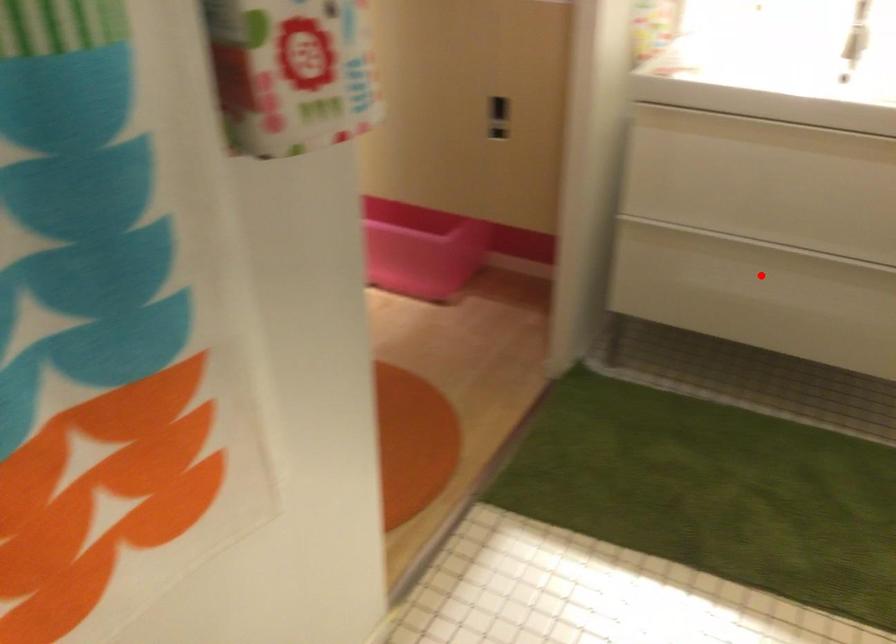
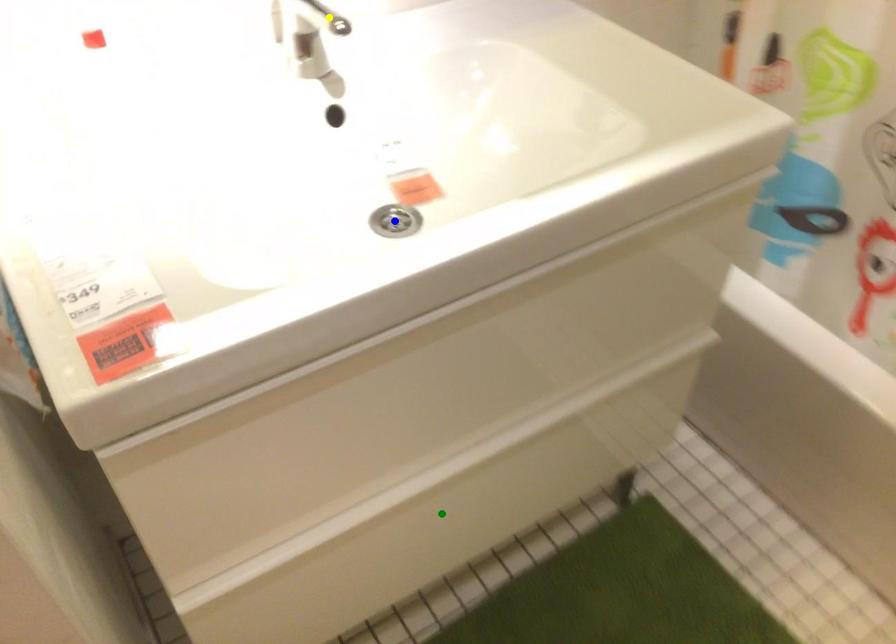
Question: I am providing you with two images of the same scene from different viewpoints. A red point is marked on the first image. You are given multiple points on the second image. Which spot in image 2 lines up with the point in image 1?

Choices:
 (A) blue point
 (B) yellow point
 (C) green point

Answer: (C)